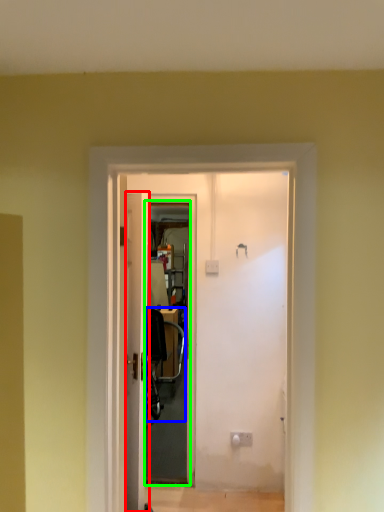
Question: Which object is positioned closest to door (highlighted by a red box)? Select from chair (highlighted by a blue box) and screen door (highlighted by a green box).

Choices:
 (A) chair
 (B) screen door

Answer: (B)